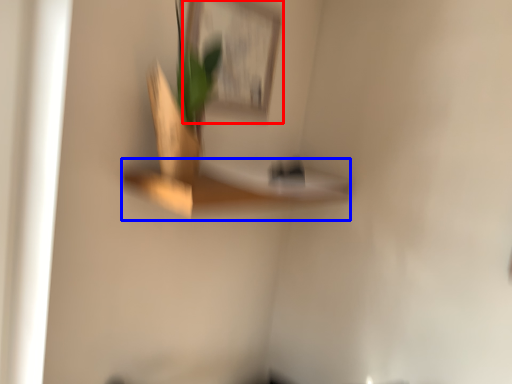
Question: Which object is closer to the camera taking this photo, picture frame (highlighted by a red box) or shelf (highlighted by a blue box)?

Choices:
 (A) picture frame
 (B) shelf

Answer: (B)